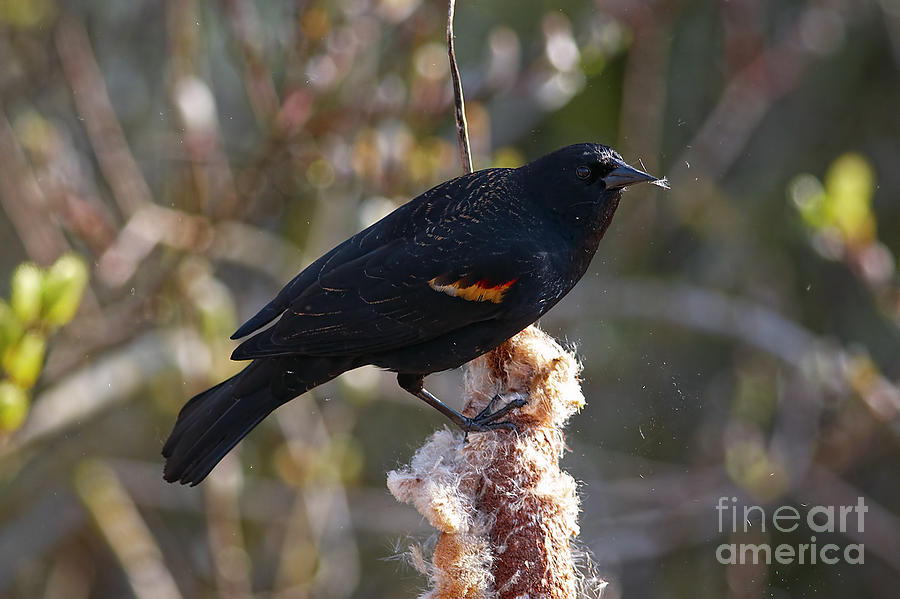
Locate an element on the screen. The image size is (900, 599). art is located at coordinates (832, 516).